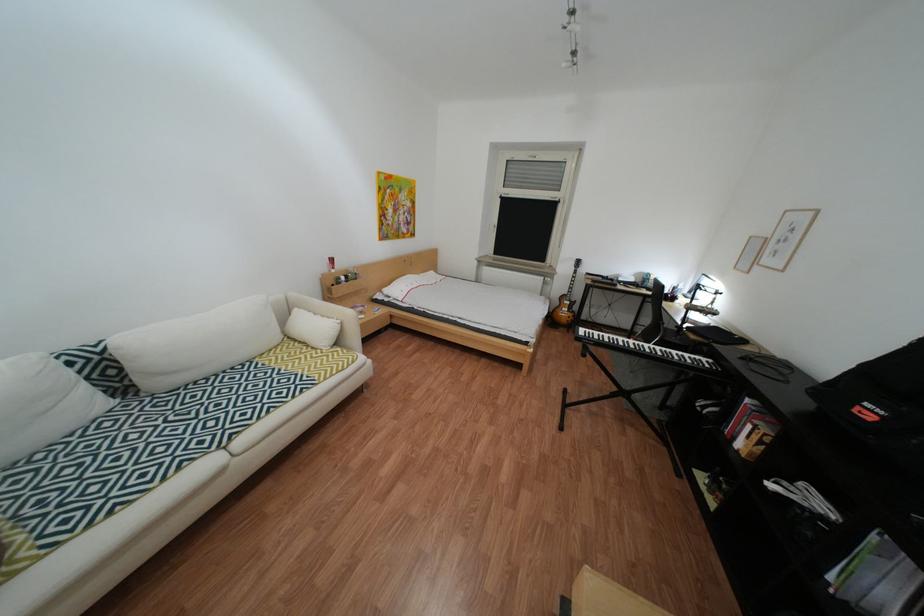
Where is `sofa armrest`? The image size is (924, 616). sofa armrest is located at coordinates (331, 318).